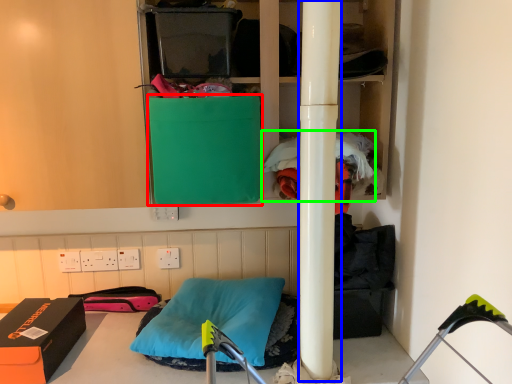
Question: Estimate the real-world distances between objects in this image. Which object is farther from box (highlighted by a red box), beam (highlighted by a blue box) or clothing (highlighted by a green box)?

Choices:
 (A) beam
 (B) clothing

Answer: (A)